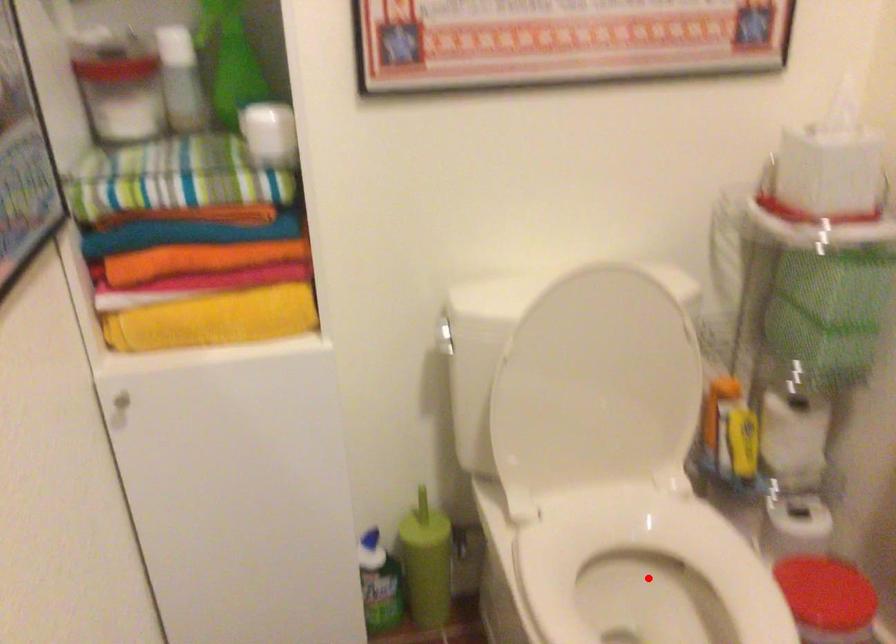
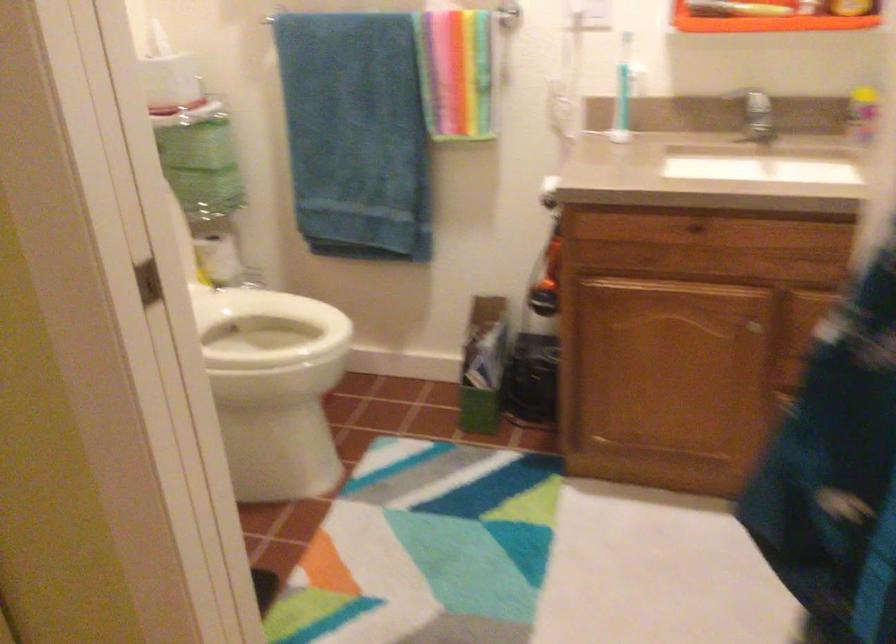
Question: I am providing you with two images of the same scene from different viewpoints. A red point is marked on the first image. Can you still see the location of the red point in image 2?

Choices:
 (A) Yes
 (B) No

Answer: (B)